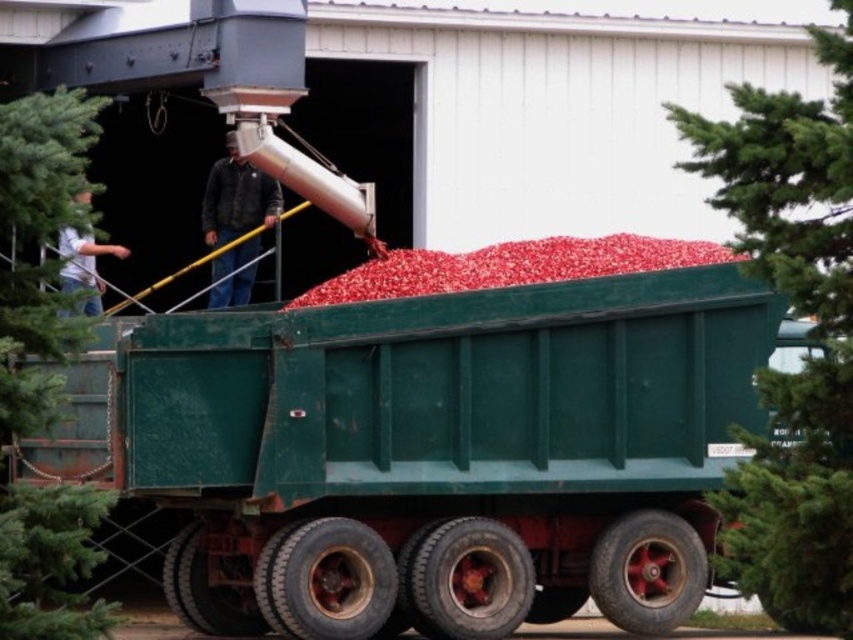
You are a farmer standing near the green textured tree at left and the dark brown leather jacket at center. You want to walk from the tree to the jacket. Which direction should you move relative to the tree?

Since the green textured tree at left is in front of the dark brown leather jacket at center, you should move backward away from the jacket to reach it.

You are a farmer trying to park your green matte truck at center next to the green textured tree at lower right. Can you fit the truck between the tree and the warehouse without overlapping them?

The green matte truck at center is thinner than the green textured tree at lower right, so it can fit between them as long as there is enough space between the tree and the warehouse.

In the scene shown: You are a worker at the warehouse and need to load a heavy crate onto the green matte truck at center. However, you notice a dark brown leather jacket at center nearby. Considering the height difference between the two, which object is easier to place the crate on top of?

The dark brown leather jacket at center is taller than the green matte truck at center, so placing the crate on top of the dark brown leather jacket at center would be easier since it offers a higher surface.